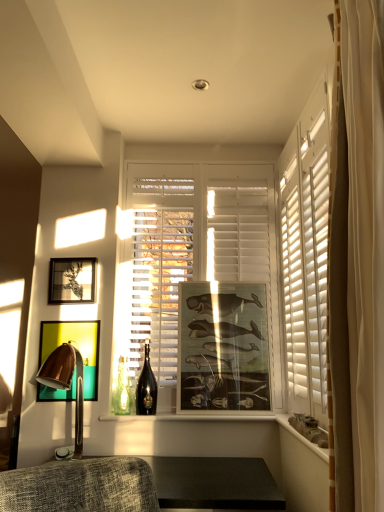
At what (x,y) coordinates should I click in order to perform the action: click on free space above white matte window at center (from a real-world perspective). Please return your answer as a coordinate pair (x, y). Image resolution: width=384 pixels, height=512 pixels. Looking at the image, I should click on (206, 153).